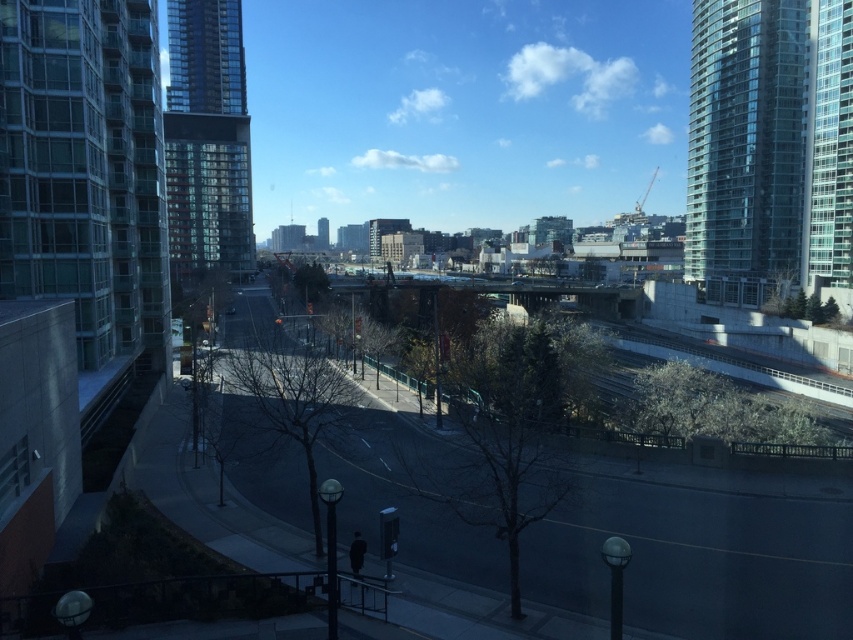
You are a delivery driver approaching the road intersection. You need to deliver a package to the glassy reflective building at left and then to the glassy reflective skyscraper at left. Which building should you visit first according to their positions?

The glassy reflective building at left is in front of the glassy reflective skyscraper at left, so you should visit the glassy reflective building at left first before proceeding to the glassy reflective skyscraper at left.